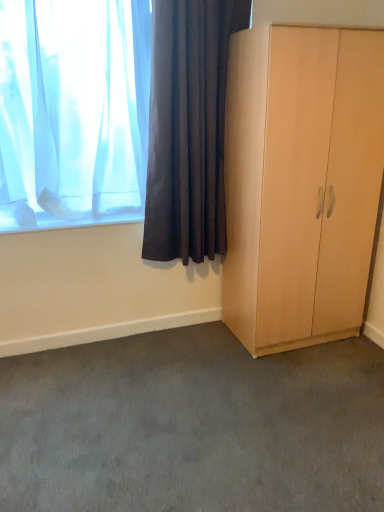
Question: Considering the relative positions of translucent fabric curtain at upper left, which is the 2th curtain in right-to-left order, and gray carpet at lower center in the image provided, is translucent fabric curtain at upper left, which is the 2th curtain in right-to-left order, to the left of gray carpet at lower center from the viewer's perspective?

Choices:
 (A) no
 (B) yes

Answer: (B)

Question: From the image's perspective, would you say translucent fabric curtain at upper left, which is the 2th curtain in right-to-left order, is positioned over gray carpet at lower center?

Choices:
 (A) yes
 (B) no

Answer: (A)

Question: Does translucent fabric curtain at upper left, which is the 2th curtain in right-to-left order, have a lesser width compared to gray carpet at lower center?

Choices:
 (A) yes
 (B) no

Answer: (A)

Question: Does translucent fabric curtain at upper left, which is the 2th curtain in right-to-left order, appear on the right side of gray carpet at lower center?

Choices:
 (A) no
 (B) yes

Answer: (A)

Question: Is translucent fabric curtain at upper left, which is the 2th curtain in right-to-left order, facing towards gray carpet at lower center?

Choices:
 (A) yes
 (B) no

Answer: (B)

Question: From the image's perspective, relative to light wood wardrobe at right, is gray carpet at lower center above or below?

Choices:
 (A) above
 (B) below

Answer: (B)

Question: Is point (72, 470) closer or farther from the camera than point (380, 54)?

Choices:
 (A) farther
 (B) closer

Answer: (B)

Question: Is gray carpet at lower center in front of or behind light wood wardrobe at right in the image?

Choices:
 (A) behind
 (B) front

Answer: (B)

Question: Looking at the image, does gray carpet at lower center seem bigger or smaller compared to light wood wardrobe at right?

Choices:
 (A) big
 (B) small

Answer: (B)

Question: Considering the positions of point (238, 287) and point (240, 7), is point (238, 287) closer or farther from the camera than point (240, 7)?

Choices:
 (A) closer
 (B) farther

Answer: (B)

Question: Is light wood wardrobe at right bigger or smaller than dark fabric curtain at upper left, which appears as the first curtain when viewed from the right?

Choices:
 (A) small
 (B) big

Answer: (B)

Question: In terms of width, does light wood wardrobe at right look wider or thinner when compared to dark fabric curtain at upper left, which appears as the first curtain when viewed from the right?

Choices:
 (A) wide
 (B) thin

Answer: (A)

Question: From a real-world perspective, is light wood wardrobe at right physically located above or below dark fabric curtain at upper left, which appears as the first curtain when viewed from the right?

Choices:
 (A) below
 (B) above

Answer: (A)

Question: From the image's perspective, relative to gray carpet at lower center, is translucent fabric curtain at upper left, positioned as the 1th curtain in left-to-right order, above or below?

Choices:
 (A) above
 (B) below

Answer: (A)

Question: Considering their positions, is translucent fabric curtain at upper left, which is the 2th curtain in right-to-left order, located in front of or behind gray carpet at lower center?

Choices:
 (A) front
 (B) behind

Answer: (B)